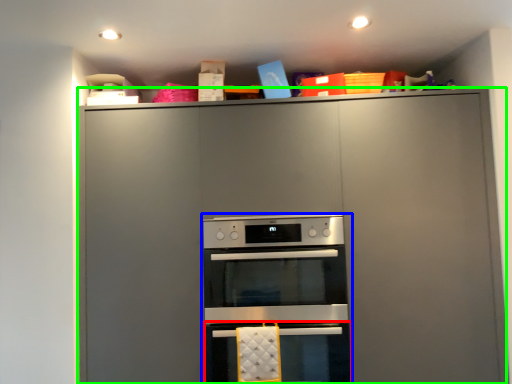
Question: Which object is positioned closest to oven (highlighted by a red box)? Select from oven (highlighted by a blue box) and cabinetry (highlighted by a green box).

Choices:
 (A) oven
 (B) cabinetry

Answer: (A)